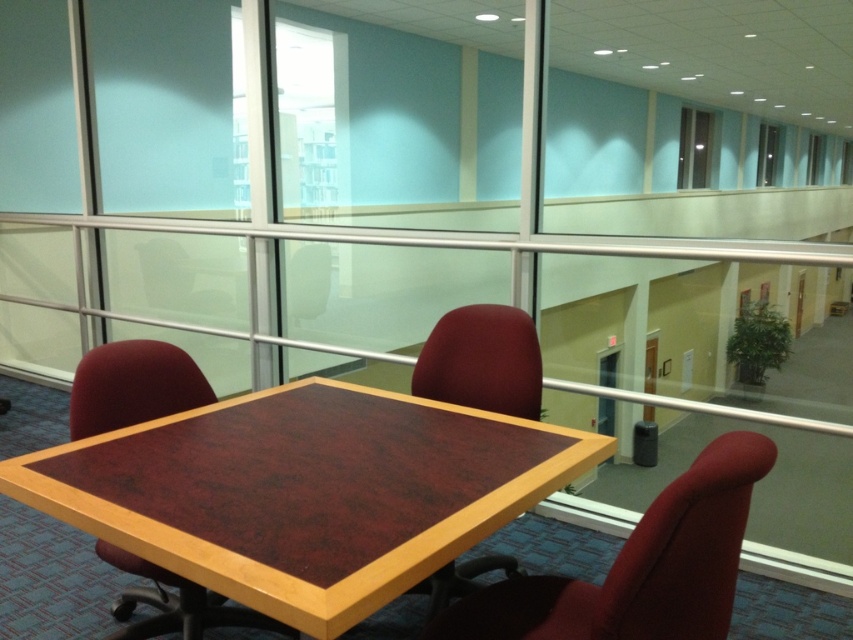
Question: Which of the following is the closest to the observer?

Choices:
 (A) (460, 593)
 (B) (260, 532)
 (C) (724, 502)
 (D) (187, 362)

Answer: (C)

Question: Which point is closer to the camera?

Choices:
 (A) (548, 616)
 (B) (532, 410)
 (C) (347, 618)

Answer: (C)

Question: Does matte red swivel chair at center have a smaller size compared to mahogany wood chair at center?

Choices:
 (A) no
 (B) yes

Answer: (A)

Question: Does mahogany wood chair at center appear on the right side of matte wood chair at center?

Choices:
 (A) yes
 (B) no

Answer: (B)

Question: Is mahogany wood table at center thinner than mahogany wood chair at center?

Choices:
 (A) no
 (B) yes

Answer: (A)

Question: Which point is closer to the camera taking this photo?

Choices:
 (A) (515, 403)
 (B) (653, 536)
 (C) (281, 509)
 (D) (173, 394)

Answer: (B)